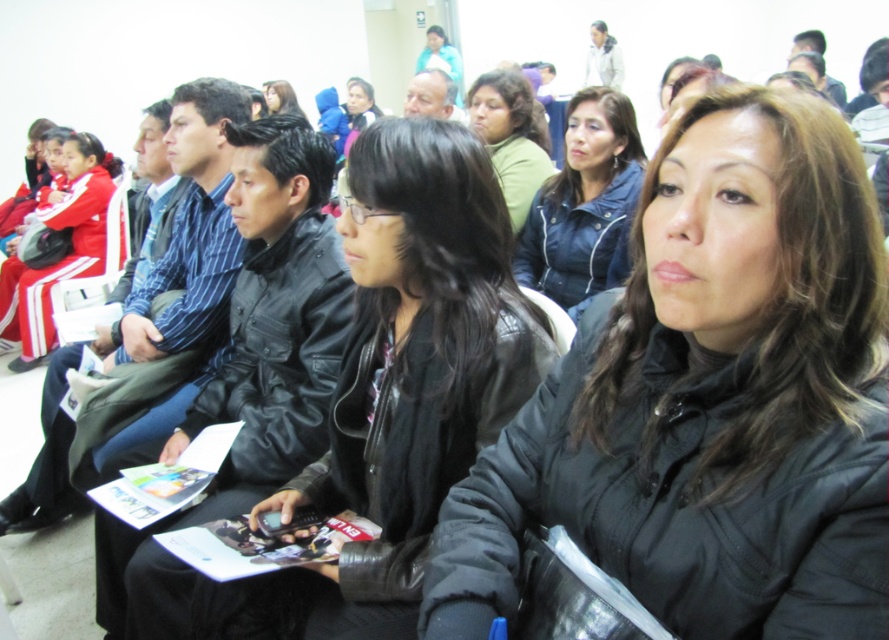
You are a photographer trying to capture a clear shot of the green matte shirt at center without the black matte jacket at center blocking it. What should you do?

Move your camera position backward so that the green matte shirt at center becomes visible behind the black matte jacket at center, since the black matte jacket at center is in front of it.

You are organizing a charity event and need to arrange two jackets on a small display table. You have the blue denim jacket at center and the matte black jacket at center. Based on their sizes, which jacket can you place first without worrying about space constraints?

The blue denim jacket at center occupies less space than the matte black jacket at center, so you can place the blue denim jacket at center first since it requires less space.

You are standing in the waiting area and want to reach a specific point marked at coordinates point (567, 224). If you can move forward 7 feet, will you be able to reach that point?

The distance of point (567, 224) from viewer is 7.72 feet, so moving forward 7 feet will not be enough to reach it. You need to move an additional 0.72 feet.